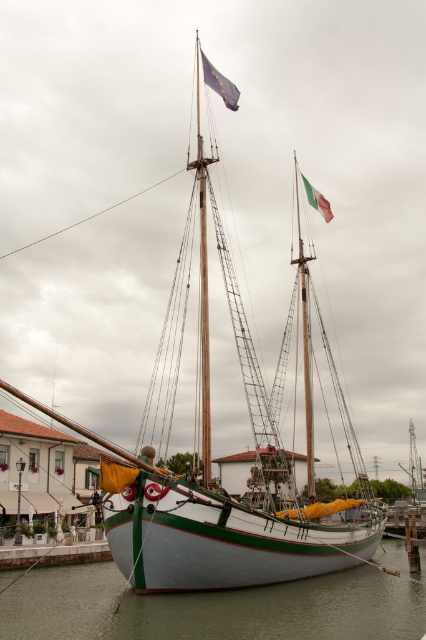
You are a sailor on the deck of the ship and need to determine which fabric is lower. You see the yellow fabric at center and the blue fabric flag at upper center. Which one is positioned lower?

The yellow fabric at center is positioned lower than the blue fabric flag at upper center because it has a lesser height compared to the blue fabric flag at upper center.

In the scene shown: You are standing on the pier looking at the boat. Which fabric is closer to you, the yellow fabric at center or the blue fabric flag at upper center?

The yellow fabric at center is closer to the viewer than the blue fabric flag at upper center.

You are a sailor trying to navigate using the blue fabric flag at upper center. The flag is positioned at coordinates 0.131, 0.516. If the ship is facing north, what direction is the flag relative to the ship?

The blue fabric flag at upper center is positioned at coordinates (219, 83). Since the ship is facing north, the flag is located to the north of the ship.